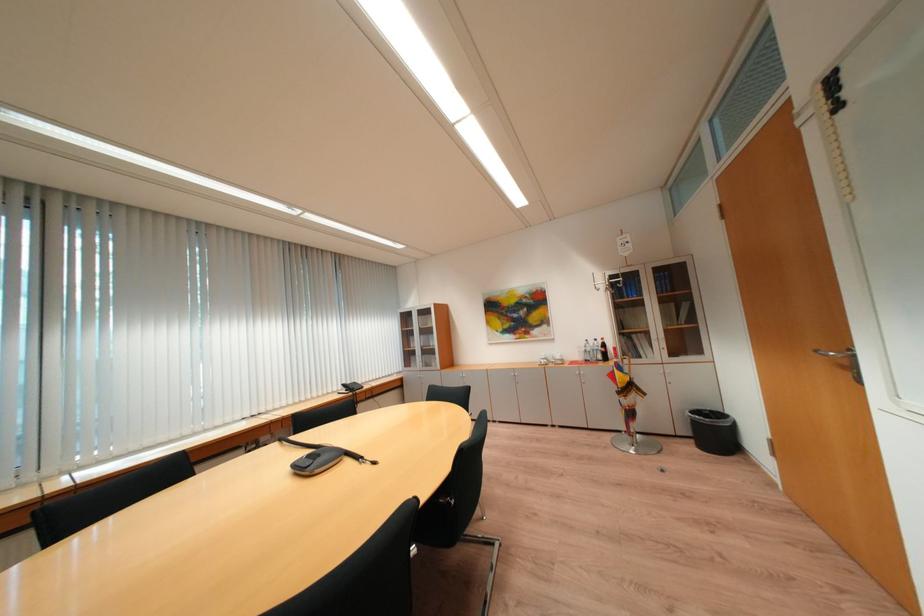
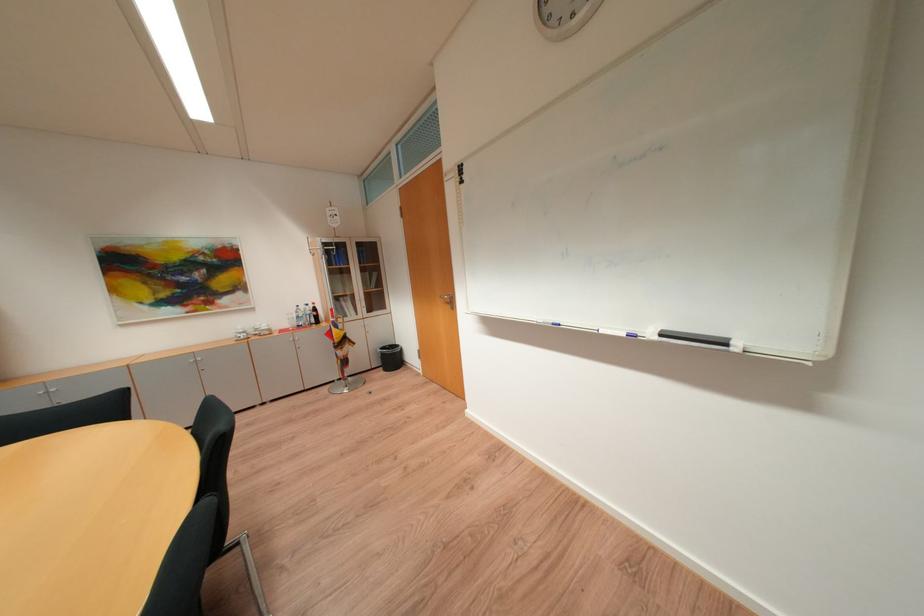
Find the pixel in the second image that matches (x=600, y=342) in the first image.

(310, 309)